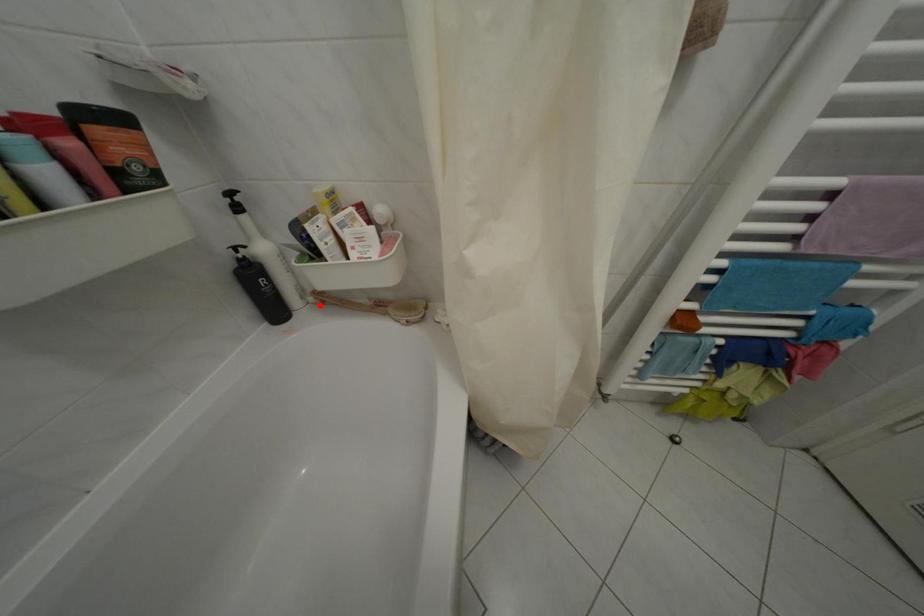
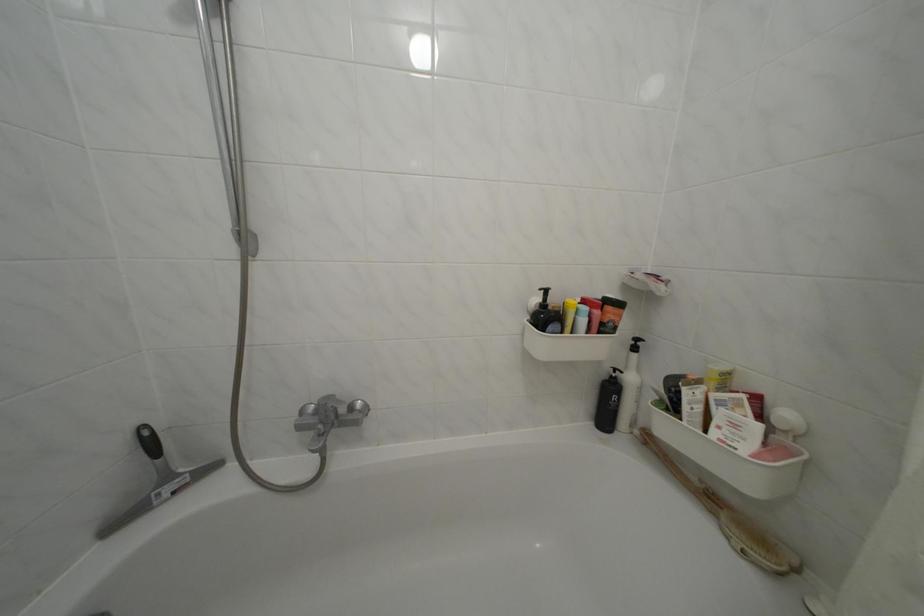
In the second image, find the point that corresponds to the highlighted location in the first image.

(646, 438)